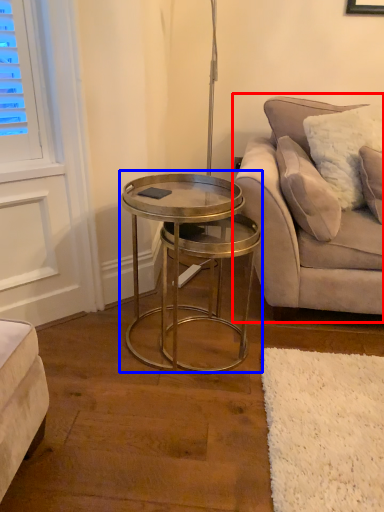
Question: Among these objects, which one is nearest to the camera, studio couch (highlighted by a red box) or coffee table (highlighted by a blue box)?

Choices:
 (A) studio couch
 (B) coffee table

Answer: (B)